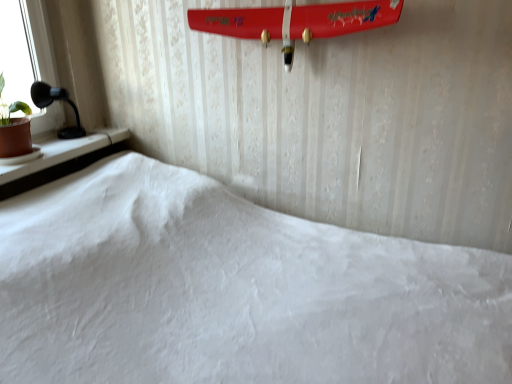
Where is `black plastic table lamp at left`? The image size is (512, 384). black plastic table lamp at left is located at coordinates (52, 102).

Locate an element on the screen. This screenshot has height=384, width=512. brown clay pot at left is located at coordinates (14, 128).

Where is `shiny red surfboard at upper center`? The width and height of the screenshot is (512, 384). shiny red surfboard at upper center is located at coordinates (296, 21).

Considering the positions of objects brown clay pot at left and shiny red surfboard at upper center in the image provided, who is more to the right, brown clay pot at left or shiny red surfboard at upper center?

shiny red surfboard at upper center is more to the right.

From a real-world perspective, relative to shiny red surfboard at upper center, is brown clay pot at left vertically above or below?

In terms of real-world spatial position, brown clay pot at left is below shiny red surfboard at upper center.

Based on the photo, can you tell me how much brown clay pot at left and shiny red surfboard at upper center differ in facing direction?

92 degrees separate the facing orientations of brown clay pot at left and shiny red surfboard at upper center.

Considering the relative positions of shiny red surfboard at upper center and black plastic table lamp at left in the image provided, is shiny red surfboard at upper center to the left or to the right of black plastic table lamp at left?

Based on their positions, shiny red surfboard at upper center is located to the right of black plastic table lamp at left.

Looking at this image, is shiny red surfboard at upper center wider than black plastic table lamp at left?

Indeed, shiny red surfboard at upper center has a greater width compared to black plastic table lamp at left.

From the image's perspective, which is below, shiny red surfboard at upper center or black plastic table lamp at left?

From the image's view, black plastic table lamp at left is below.

From a real-world perspective, is shiny red surfboard at upper center physically located above or below black plastic table lamp at left?

From a real-world perspective, shiny red surfboard at upper center is physically above black plastic table lamp at left.

The image size is (512, 384). Find the location of `table lamp directly beneath the shiny red surfboard at upper center (from a real-world perspective)`. table lamp directly beneath the shiny red surfboard at upper center (from a real-world perspective) is located at coordinates (52, 102).

From a real-world perspective, is black plastic table lamp at left positioned above or below shiny red surfboard at upper center?

black plastic table lamp at left is situated lower than shiny red surfboard at upper center in the real world.

Is black plastic table lamp at left situated inside shiny red surfboard at upper center or outside?

The correct answer is: outside.

From the image's perspective, which one is positioned higher, black plastic table lamp at left or shiny red surfboard at upper center?

shiny red surfboard at upper center appears higher in the image.

Can you confirm if black plastic table lamp at left is positioned to the left of brown clay pot at left?

No.

From the image's perspective, would you say black plastic table lamp at left is positioned over brown clay pot at left?

Indeed, from the image's perspective, black plastic table lamp at left is shown above brown clay pot at left.

From a real-world perspective, is black plastic table lamp at left over brown clay pot at left?

Actually, black plastic table lamp at left is physically below brown clay pot at left in the real world.

Considering the sizes of objects brown clay pot at left and black plastic table lamp at left in the image provided, who is bigger, brown clay pot at left or black plastic table lamp at left?

With larger size is brown clay pot at left.

This screenshot has width=512, height=384. I want to click on table lamp that is behind the brown clay pot at left, so click(x=52, y=102).

Is brown clay pot at left not near black plastic table lamp at left?

No.

Considering the relative sizes of brown clay pot at left and black plastic table lamp at left in the image provided, is brown clay pot at left wider than black plastic table lamp at left?

Correct, the width of brown clay pot at left exceeds that of black plastic table lamp at left.

Is shiny red surfboard at upper center to the right of brown clay pot at left from the viewer's perspective?

Yes, shiny red surfboard at upper center is to the right of brown clay pot at left.

Is shiny red surfboard at upper center inside or outside of brown clay pot at left?

shiny red surfboard at upper center is spatially situated outside brown clay pot at left.

In the scene shown: From a real-world perspective, which object rests below the other?

brown clay pot at left is physically lower.

Identify the location of houseplant that appears below the shiny red surfboard at upper center (from the image's perspective). (14, 128).

Locate an element on the screen. surfboard that appears in front of the black plastic table lamp at left is located at coordinates (296, 21).

Considering their positions, is brown clay pot at left positioned closer to black plastic table lamp at left than shiny red surfboard at upper center?

brown clay pot at left.

Which object lies nearer to the anchor point brown clay pot at left, black plastic table lamp at left or shiny red surfboard at upper center?

black plastic table lamp at left.

Considering their positions, is brown clay pot at left positioned further to shiny red surfboard at upper center than black plastic table lamp at left?

The object further to shiny red surfboard at upper center is brown clay pot at left.

From the image, which object appears to be farther from black plastic table lamp at left, shiny red surfboard at upper center or brown clay pot at left?

shiny red surfboard at upper center is further to black plastic table lamp at left.

Which object lies nearer to the anchor point brown clay pot at left, shiny red surfboard at upper center or black plastic table lamp at left?

black plastic table lamp at left.

From the image, which object appears to be nearer to shiny red surfboard at upper center, black plastic table lamp at left or brown clay pot at left?

black plastic table lamp at left is positioned closer to the anchor shiny red surfboard at upper center.

Where is `table lamp located between brown clay pot at left and shiny red surfboard at upper center in the left-right direction`? table lamp located between brown clay pot at left and shiny red surfboard at upper center in the left-right direction is located at coordinates (52, 102).